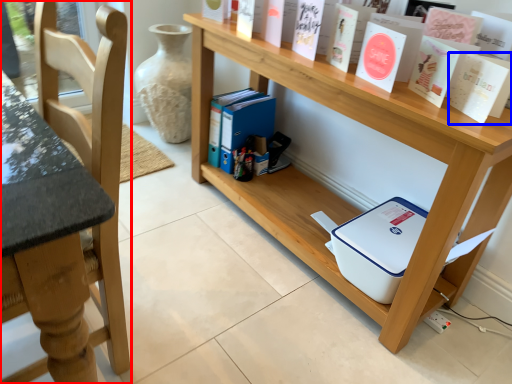
Question: Among these objects, which one is farthest to the camera, chair (highlighted by a red box) or paperback book (highlighted by a blue box)?

Choices:
 (A) chair
 (B) paperback book

Answer: (B)